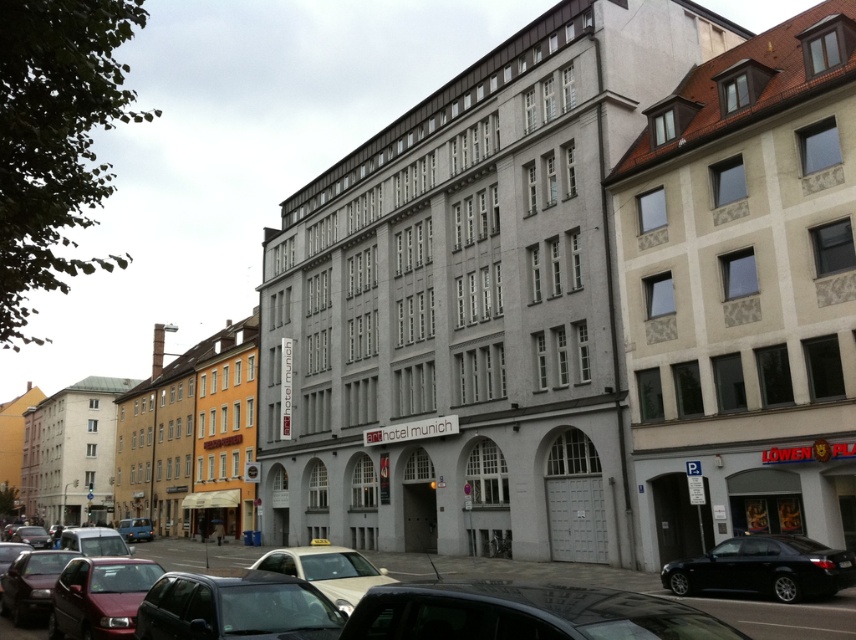
Question: Does shiny red car at lower left have a smaller size compared to blue metallic car at center?

Choices:
 (A) yes
 (B) no

Answer: (A)

Question: Does matte black car at lower left appear under beige matte car at center?

Choices:
 (A) no
 (B) yes

Answer: (A)

Question: Based on their relative distances, which object is farther from the matte black car at lower left?

Choices:
 (A) blue metallic car at center
 (B) shiny black car at lower center
 (C) black metallic car at lower right

Answer: (A)

Question: Which point is closer to the camera taking this photo?

Choices:
 (A) click(x=57, y=554)
 (B) click(x=669, y=605)
 (C) click(x=831, y=556)

Answer: (A)

Question: Can you confirm if matte black car at lower left is wider than beige matte car at center?

Choices:
 (A) no
 (B) yes

Answer: (B)

Question: Among these objects, which one is farthest from the camera?

Choices:
 (A) beige matte car at center
 (B) shiny red car at lower left
 (C) shiny black car at lower center

Answer: (B)